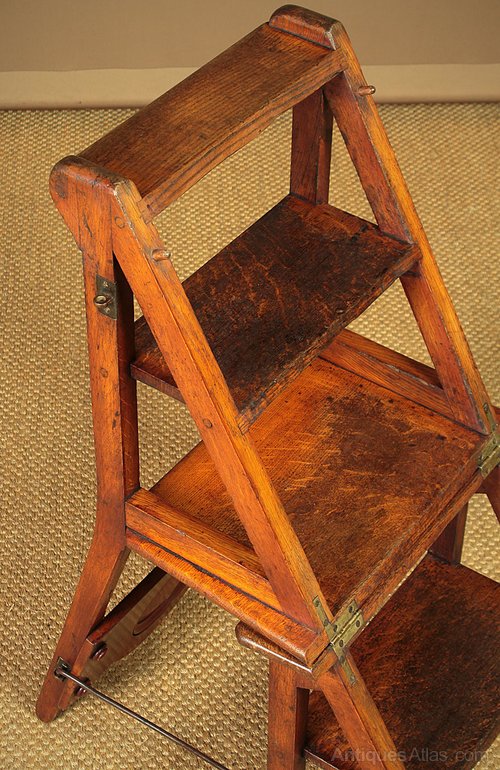
Where is `hinge`? Image resolution: width=500 pixels, height=770 pixels. hinge is located at coordinates (343, 635).